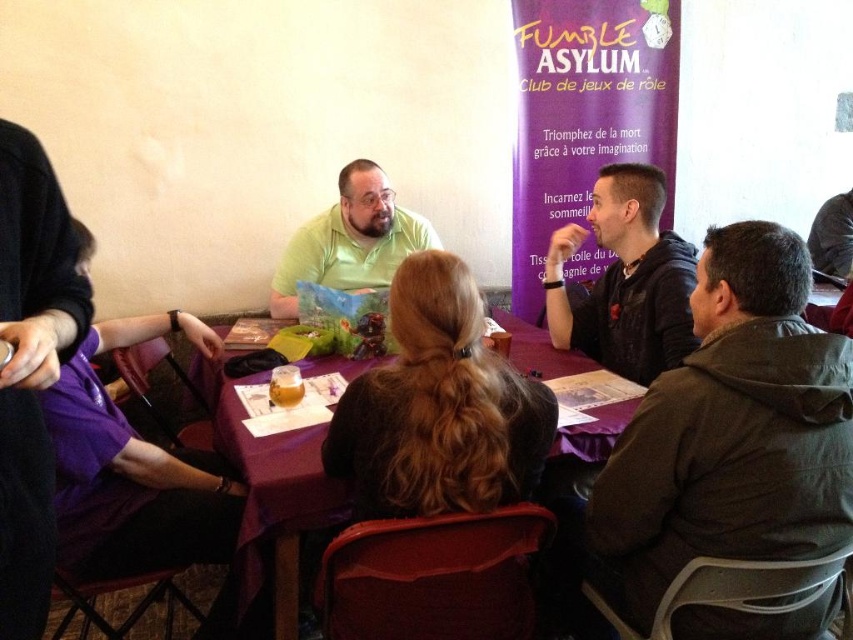
Question: Estimate the real-world distances between objects in this image. Which object is closer to the dark gray hoodie at lower right?

Choices:
 (A) green matte shirt at center
 (B) purple fabric table at center

Answer: (B)

Question: Among these objects, which one is farthest from the camera?

Choices:
 (A) green matte shirt at center
 (B) dark gray hoodie at lower right
 (C) purple fabric table at center
 (D) black leather jacket at center

Answer: (A)

Question: Does dark gray hoodie at lower right have a greater width compared to green matte shirt at center?

Choices:
 (A) no
 (B) yes

Answer: (A)

Question: Which of the following is the farthest from the observer?

Choices:
 (A) (221, 435)
 (B) (376, 273)

Answer: (B)

Question: Is black leather jacket at center wider than green matte shirt at center?

Choices:
 (A) yes
 (B) no

Answer: (B)

Question: Can you confirm if purple fabric table at center is positioned to the right of black leather jacket at center?

Choices:
 (A) yes
 (B) no

Answer: (B)